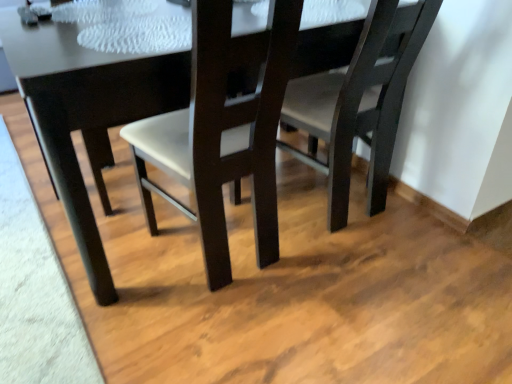
Question: Is matte dark wood chair at center, which is counted as the second chair, starting from the left, to the left of matte dark wood chair at center, which ranks as the first chair in left-to-right order, from the viewer's perspective?

Choices:
 (A) no
 (B) yes

Answer: (A)

Question: Can you confirm if matte dark wood chair at center, which ranks as the 1th chair in right-to-left order, is taller than matte dark wood chair at center, the second chair when ordered from right to left?

Choices:
 (A) no
 (B) yes

Answer: (A)

Question: Is matte dark wood chair at center, which is counted as the second chair, starting from the left, outside of matte dark wood chair at center, which ranks as the first chair in left-to-right order?

Choices:
 (A) no
 (B) yes

Answer: (B)

Question: Is matte dark wood chair at center, which is counted as the second chair, starting from the left, thinner than matte dark wood chair at center, the second chair when ordered from right to left?

Choices:
 (A) no
 (B) yes

Answer: (B)

Question: Is matte dark wood chair at center, which is counted as the second chair, starting from the left, closer to camera compared to matte dark wood chair at center, the second chair when ordered from right to left?

Choices:
 (A) no
 (B) yes

Answer: (A)

Question: From the image's perspective, is matte dark wood chair at center, which ranks as the 1th chair in right-to-left order, on top of matte dark wood chair at center, which ranks as the first chair in left-to-right order?

Choices:
 (A) no
 (B) yes

Answer: (B)

Question: Is matte dark wood chair at center, which ranks as the first chair in left-to-right order, not close to matte dark wood chair at center, which is counted as the second chair, starting from the left?

Choices:
 (A) yes
 (B) no

Answer: (B)

Question: Is matte dark wood chair at center, the second chair when ordered from right to left, bigger than matte dark wood chair at center, which is counted as the second chair, starting from the left?

Choices:
 (A) no
 (B) yes

Answer: (B)

Question: Is matte dark wood chair at center, which ranks as the first chair in left-to-right order, turned away from matte dark wood chair at center, which is counted as the second chair, starting from the left?

Choices:
 (A) no
 (B) yes

Answer: (A)

Question: Does matte dark wood chair at center, the second chair when ordered from right to left, have a greater width compared to matte dark wood chair at center, which is counted as the second chair, starting from the left?

Choices:
 (A) yes
 (B) no

Answer: (A)

Question: Could you tell me if matte dark wood chair at center, the second chair when ordered from right to left, is turned towards matte dark wood chair at center, which is counted as the second chair, starting from the left?

Choices:
 (A) yes
 (B) no

Answer: (B)

Question: Can we say matte dark wood chair at center, the second chair when ordered from right to left, lies outside matte dark wood chair at center, which is counted as the second chair, starting from the left?

Choices:
 (A) no
 (B) yes

Answer: (B)

Question: Would you say matte dark wood chair at center, which is counted as the second chair, starting from the left, is outside matte black table at center?

Choices:
 (A) no
 (B) yes

Answer: (A)